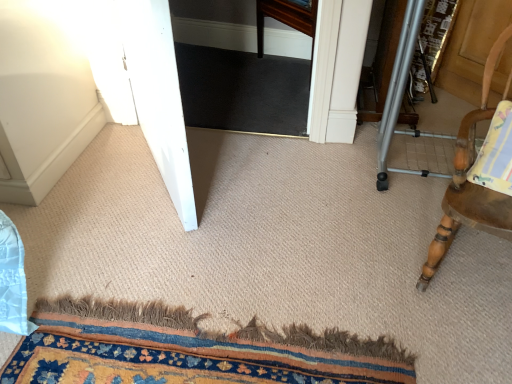
Question: Is white glossy screen door at left positioned before wooden chair with striped cushion at right?

Choices:
 (A) no
 (B) yes

Answer: (A)

Question: Considering the relative sizes of white glossy screen door at left and wooden chair with striped cushion at right in the image provided, is white glossy screen door at left wider than wooden chair with striped cushion at right?

Choices:
 (A) no
 (B) yes

Answer: (A)

Question: Is white glossy screen door at left facing away from wooden chair with striped cushion at right?

Choices:
 (A) yes
 (B) no

Answer: (B)

Question: From the image's perspective, is white glossy screen door at left above wooden chair with striped cushion at right?

Choices:
 (A) no
 (B) yes

Answer: (B)

Question: Does white glossy screen door at left appear on the left side of wooden chair with striped cushion at right?

Choices:
 (A) yes
 (B) no

Answer: (A)

Question: In terms of size, does wooden chair with striped cushion at right appear bigger or smaller than white glossy screen door at left?

Choices:
 (A) big
 (B) small

Answer: (B)

Question: From a real-world perspective, is wooden chair with striped cushion at right physically located above or below white glossy screen door at left?

Choices:
 (A) above
 (B) below

Answer: (B)

Question: Is wooden chair with striped cushion at right situated inside white glossy screen door at left or outside?

Choices:
 (A) outside
 (B) inside

Answer: (A)

Question: Looking at their shapes, would you say wooden chair with striped cushion at right is wider or thinner than white glossy screen door at left?

Choices:
 (A) thin
 (B) wide

Answer: (B)

Question: From the image's perspective, relative to carpeted mat at lower center, is wooden chair with striped cushion at right above or below?

Choices:
 (A) above
 (B) below

Answer: (A)

Question: Is wooden chair with striped cushion at right situated inside carpeted mat at lower center or outside?

Choices:
 (A) outside
 (B) inside

Answer: (A)

Question: Is wooden chair with striped cushion at right taller or shorter than carpeted mat at lower center?

Choices:
 (A) short
 (B) tall

Answer: (B)

Question: Looking at their shapes, would you say wooden chair with striped cushion at right is wider or thinner than carpeted mat at lower center?

Choices:
 (A) wide
 (B) thin

Answer: (B)

Question: From a real-world perspective, is carpeted mat at lower center above or below white glossy screen door at left?

Choices:
 (A) below
 (B) above

Answer: (A)

Question: In terms of height, does carpeted mat at lower center look taller or shorter compared to white glossy screen door at left?

Choices:
 (A) short
 (B) tall

Answer: (A)